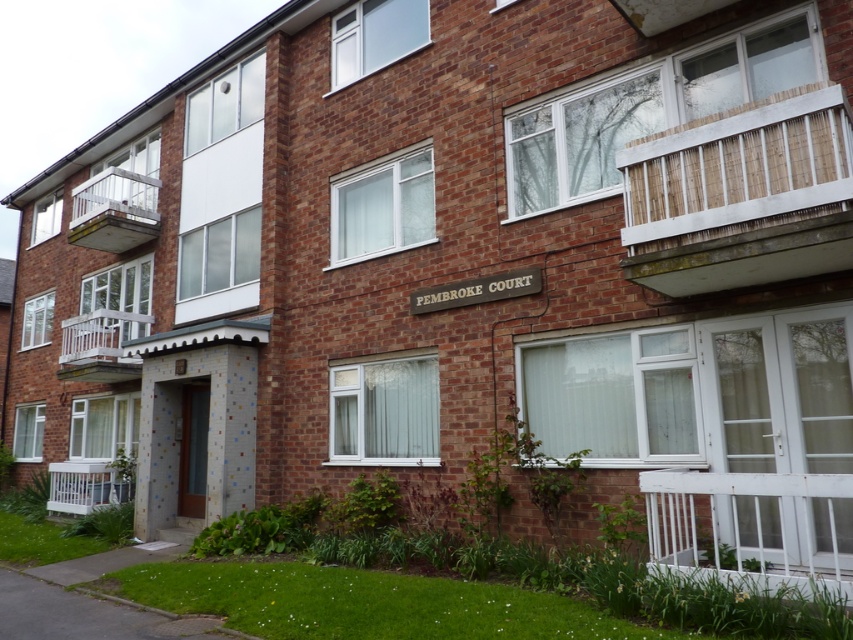
Question: Is white wooden balcony at lower right thinner than white plastic balcony at lower left?

Choices:
 (A) yes
 (B) no

Answer: (A)

Question: Which point is closer to the camera?

Choices:
 (A) white bamboo balcony at upper right
 (B) white wooden balcony at lower left
 (C) white plastic balcony at lower left
 (D) white wooden balcony at lower right

Answer: (D)

Question: Does white wooden balcony at lower right lie in front of white plastic balcony at lower left?

Choices:
 (A) no
 (B) yes

Answer: (B)

Question: Estimate the real-world distances between objects in this image. Which object is closer to the wooden white balcony at left?

Choices:
 (A) white wooden balcony at lower left
 (B) white bamboo balcony at upper right
 (C) white wooden balcony at lower right

Answer: (A)

Question: Based on their relative distances, which object is farther from the white wooden balcony at lower right?

Choices:
 (A) white wooden balcony at lower left
 (B) white plastic balcony at lower left
 (C) wooden white balcony at left

Answer: (C)

Question: Does wooden white balcony at left appear on the left side of white wooden balcony at lower left?

Choices:
 (A) yes
 (B) no

Answer: (B)